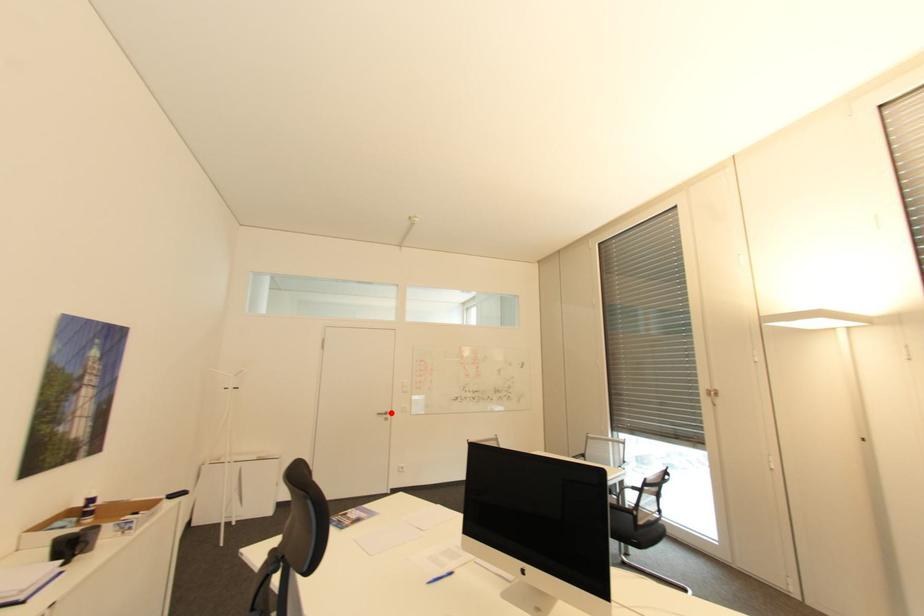
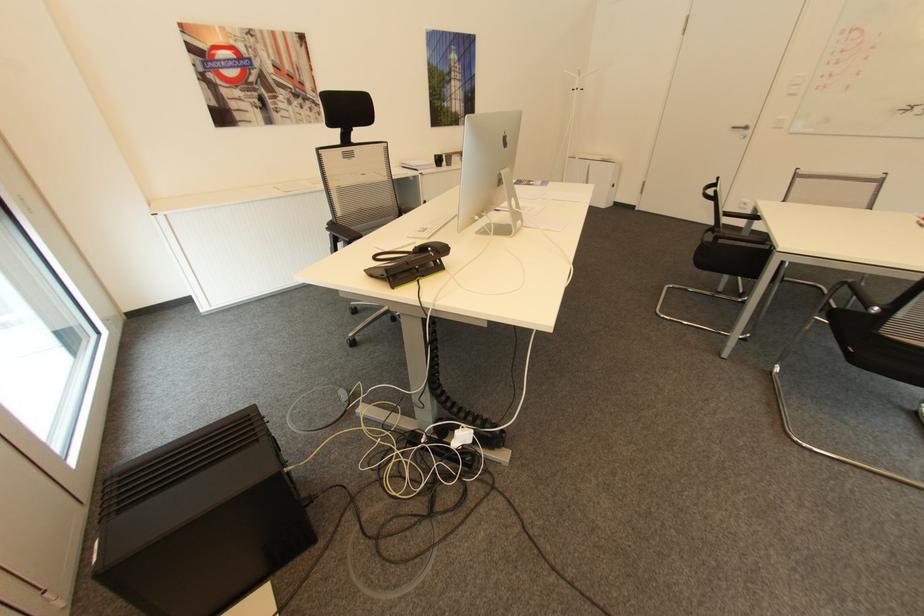
Where in the second image is the point corresponding to the highlighted location from the first image?

(749, 128)